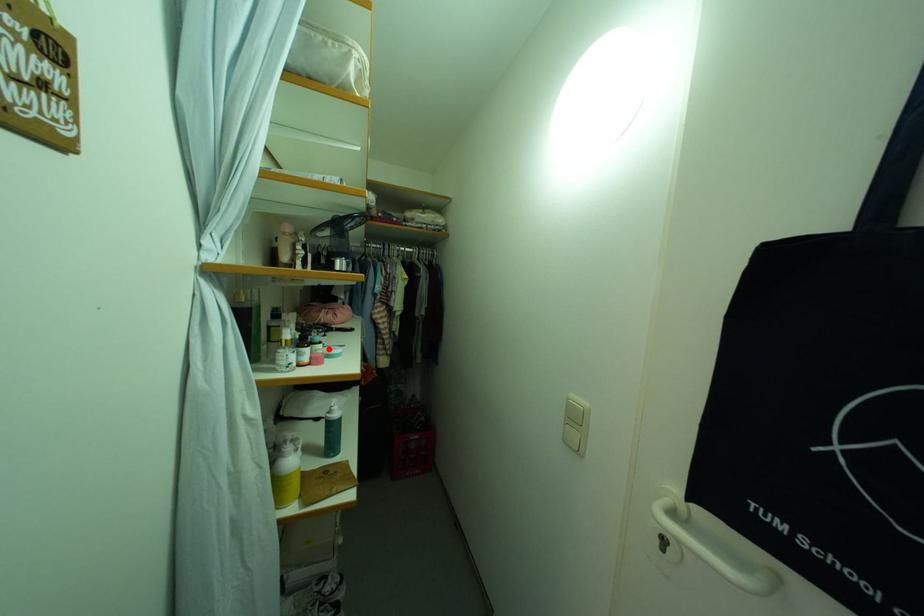
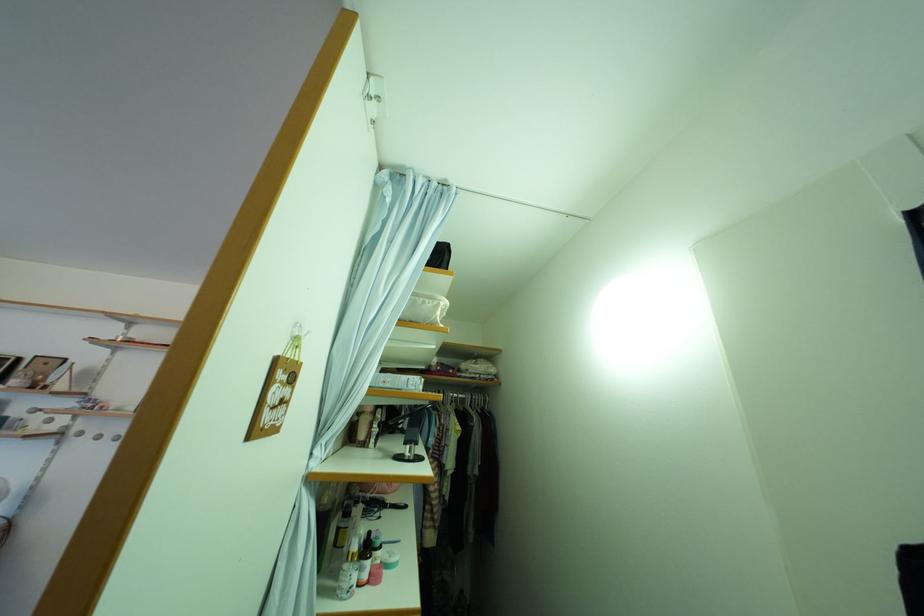
Find the pixel in the second image that matches the highlighted location in the first image.

(390, 554)